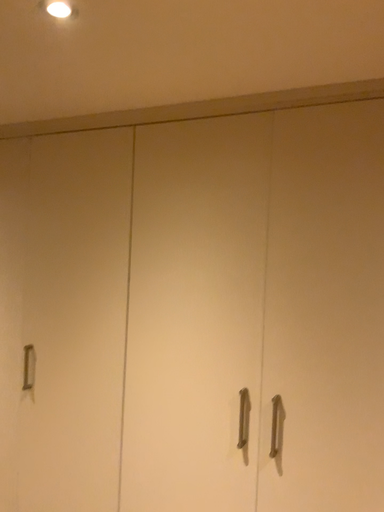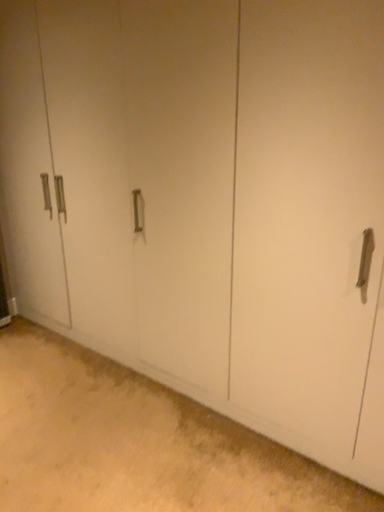
Question: How did the camera likely rotate when shooting the video?

Choices:
 (A) rotated upward
 (B) rotated downward

Answer: (B)